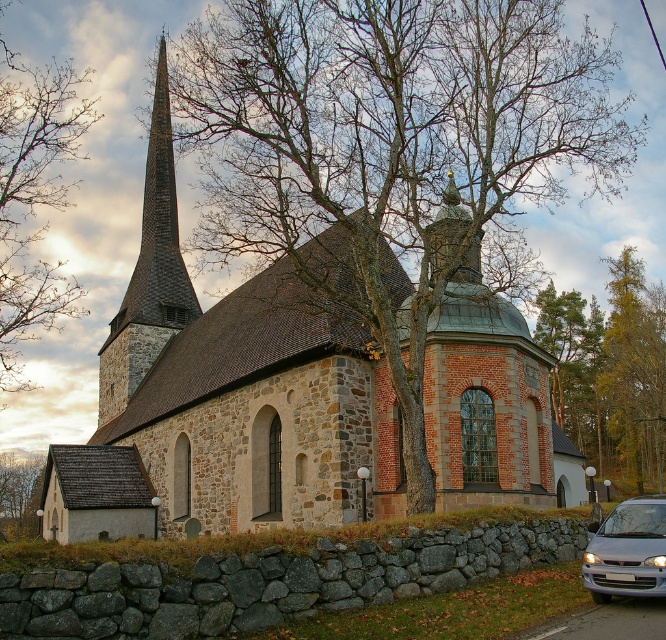
Can you confirm if green leafy tree at upper center is wider than dark brown stone steeple at upper left?

Yes.

Who is shorter, green leafy tree at upper center or dark brown stone steeple at upper left?

With less height is green leafy tree at upper center.

This screenshot has height=640, width=666. I want to click on green leafy tree at upper center, so click(609, 371).

You are a GUI agent. You are given a task and a screenshot of the screen. Output one action in this format:
    pyautogui.click(x=<x>, y=<y>)
    Task: Click on the green leafy tree at upper center
    This screenshot has height=640, width=666.
    Given the screenshot: What is the action you would take?
    pyautogui.click(x=609, y=371)

Can you confirm if green leafy tree at upper center is smaller than brown bark tree at lower left?

No.

How distant is green leafy tree at upper center from brown bark tree at lower left?

A distance of 132.57 meters exists between green leafy tree at upper center and brown bark tree at lower left.

Does point (597, 344) lie behind point (9, 460)?

No, (597, 344) is closer to viewer.

Locate an element on the screen. The image size is (666, 640). green leafy tree at upper center is located at coordinates (609, 371).

Which is above, bare branches at left or dark brown stone steeple at upper left?

bare branches at left

Based on the photo, between bare branches at left and dark brown stone steeple at upper left, which one appears on the right side from the viewer's perspective?

Positioned to the right is dark brown stone steeple at upper left.

Image resolution: width=666 pixels, height=640 pixels. Describe the element at coordinates (33, 196) in the screenshot. I see `bare branches at left` at that location.

I want to click on bare branches at left, so click(x=33, y=196).